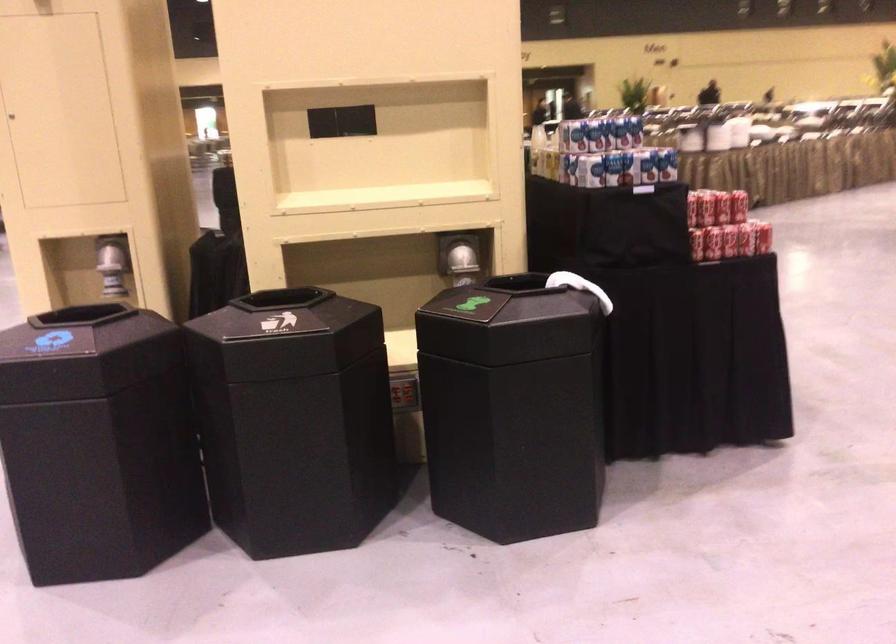
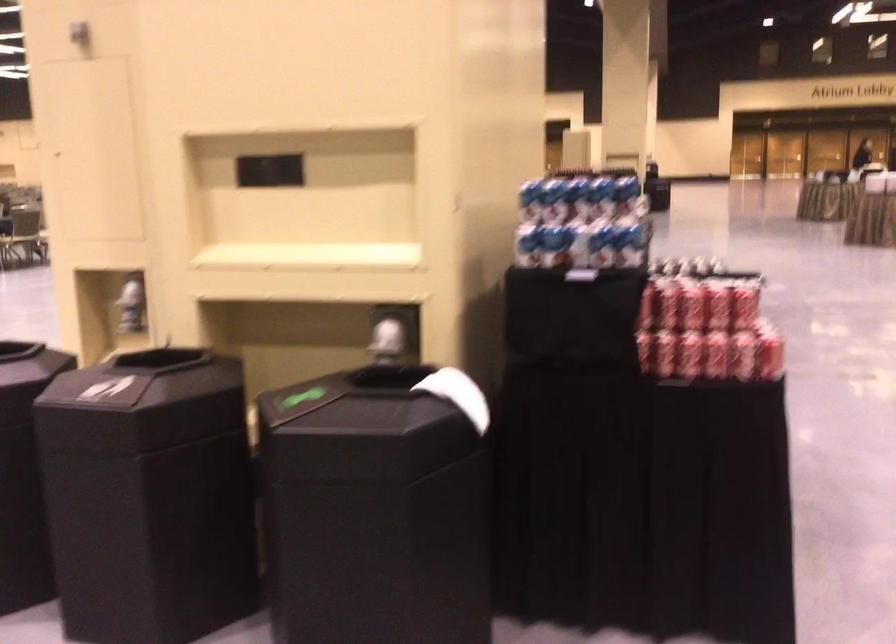
Where in the second image is the point corresponding to (736,240) from the first image?

(716, 355)